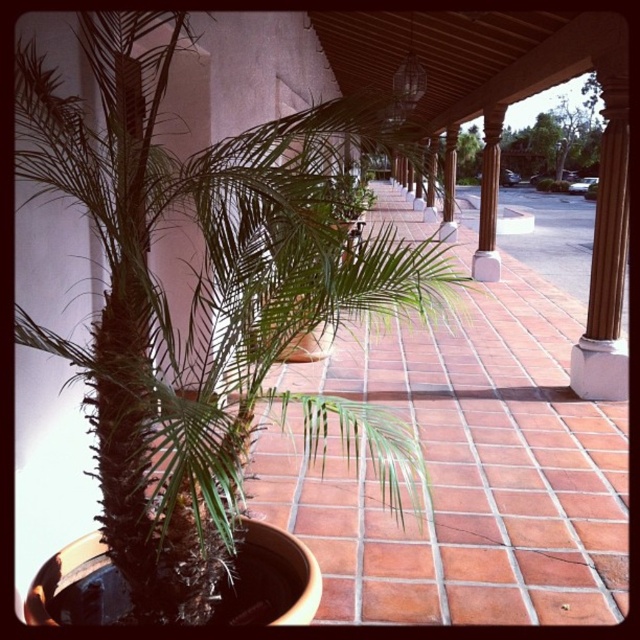
You are standing on the walkway and want to place a 30 inch long decorative bench between the green leafy palm at center and the nearest walkway tile. Will the bench fit without overlapping either?

The distance between the green leafy palm at center and the nearest walkway tile is 28.92 inches. Since the bench is 30 inches long, it will not fit as it is longer than the available space.

You are standing on the walkway and want to know which object is wider between the green leafy palm at center and the brown polished wood column at center. Can you tell me?

The green leafy palm at center is wider than the brown polished wood column at center.

You are standing at the entrance of the walkway and want to place a bench exactly at the center of the walkway. Given the coordinates of the green leafy palm at center, can you determine if the bench will be placed directly in front of the palm?

The green leafy palm at center is located at coordinates point (209, 292). Since the bench is to be placed at the center of the walkway, which would be at coordinates (320, 320), the bench will be placed slightly to the right and above the palm, not directly in front of it.